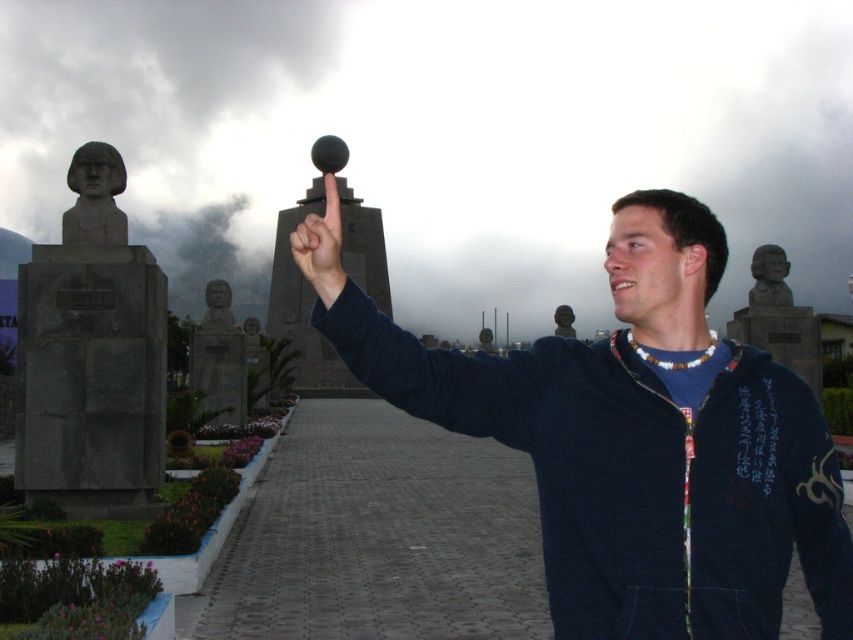
You are a tour guide standing at the Mitad del Mundo monument. You notice a tourist wearing a matte black jacket at center and a historical figure bust named matte gray bust at center. The tourist asks you if they can walk directly from their current position to the bust without crossing any restricted areas. Based on the spatial information provided, can they do so?

The distance between the matte black jacket at center and the matte gray bust at center is 63.19 meters. Since there are no obstacles or restricted areas mentioned in the scene description, the tourist can walk directly to the bust.

You are a tour guide at the Mitad del Mundo monument. A visitor asks if the matte black finger at center is pointing towards the matte gray bust at center. Based on the scene description, how would you respond?

The matte black finger at center is above the matte gray bust at center, so it is pointing towards it.

You are a tour guide at the Mitad del Mundo monument. A visitor asks if the matte black jacket at center is bigger than the matte gray bust at center. How do you respond?

The matte black jacket at center is indeed larger in size than the matte gray bust at center, so yes, it is bigger.